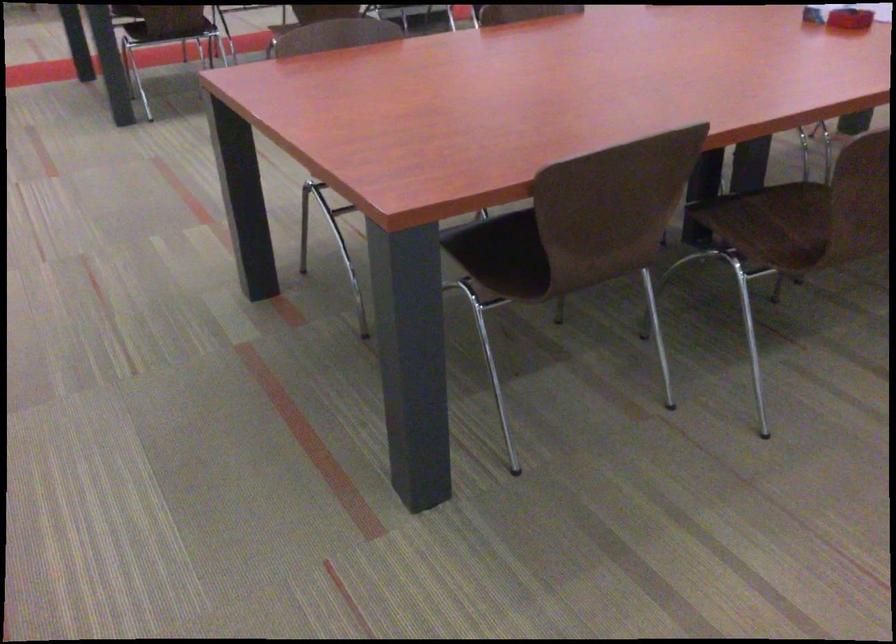
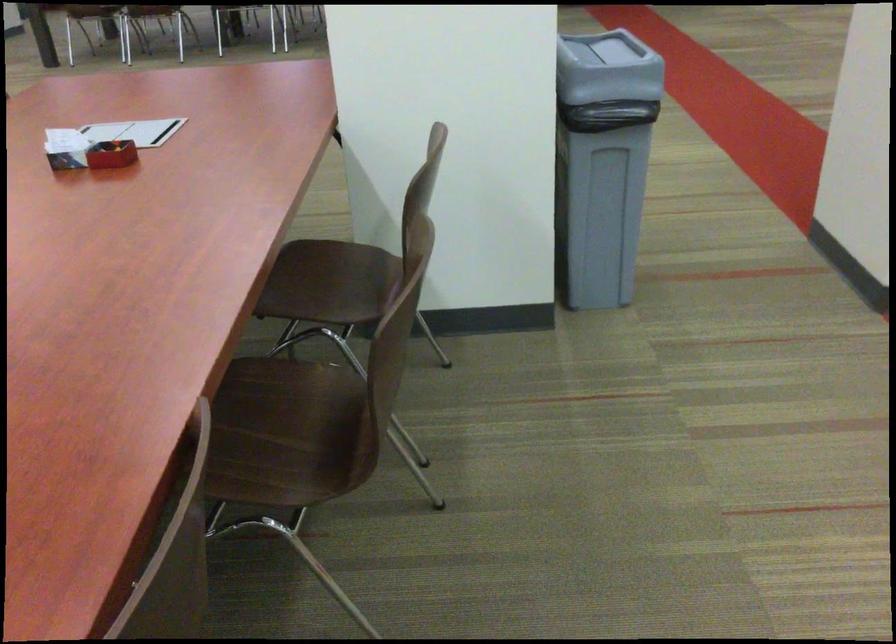
Question: The camera is either moving clockwise (left) or counter-clockwise (right) around the object. The first image is from the beginning of the video and the second image is from the end. Is the camera moving left or right when shooting the video?

Choices:
 (A) Left
 (B) Right

Answer: (A)